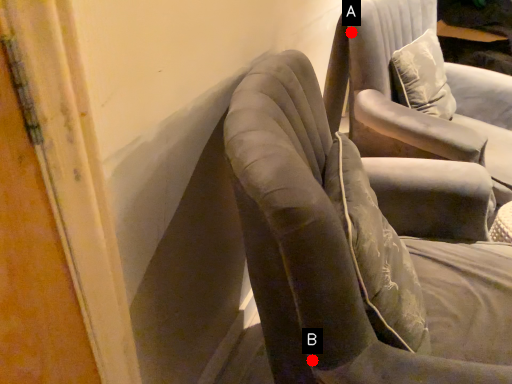
Question: Two points are circled on the image, labeled by A and B beside each circle. Which point is farther to the camera?

Choices:
 (A) A is further
 (B) B is further

Answer: (A)